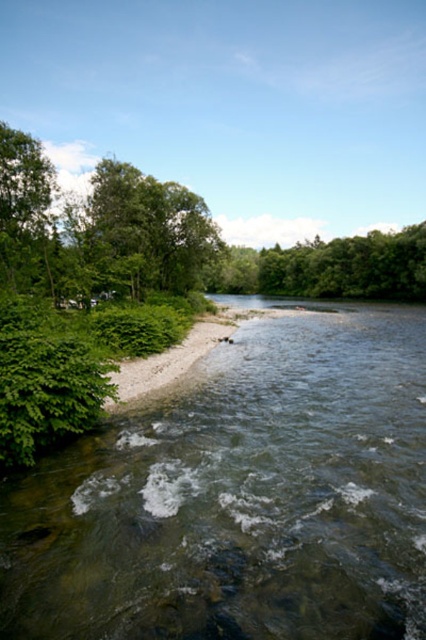
Question: Can you confirm if green leafy tree at upper left is positioned to the right of green gravel shoreline at lower left?

Choices:
 (A) yes
 (B) no

Answer: (B)

Question: Which object is farther from the camera taking this photo?

Choices:
 (A) green leafy tree at upper left
 (B) green leafy trees at center

Answer: (B)

Question: Based on their relative distances, which object is farther from the green leafy trees at center?

Choices:
 (A) green gravel shoreline at lower left
 (B) clear water at river center
 (C) green leafy tree at upper left
 (D) green leafy tree at left

Answer: (D)

Question: Which object is the farthest from the clear water at river center?

Choices:
 (A) green leafy tree at left
 (B) green leafy trees at center

Answer: (B)

Question: Does green leafy trees at center have a smaller size compared to green leafy tree at left?

Choices:
 (A) yes
 (B) no

Answer: (B)

Question: Can you confirm if green leafy tree at left is wider than green gravel shoreline at lower left?

Choices:
 (A) no
 (B) yes

Answer: (B)